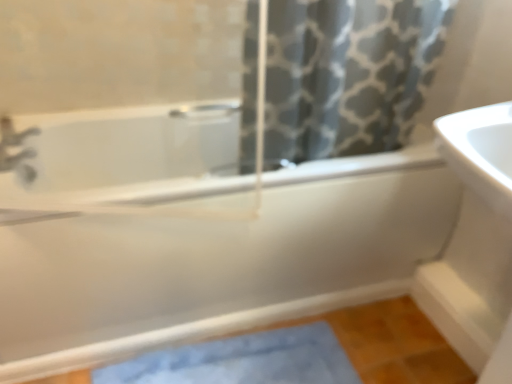
Question: Should I look upward or downward to see gray printed fabric at upper center?

Choices:
 (A) up
 (B) down

Answer: (A)

Question: From a real-world perspective, is white glossy sink at right positioned over blue fabric bath mat at lower center based on gravity?

Choices:
 (A) yes
 (B) no

Answer: (A)

Question: Are white glossy sink at right and blue fabric bath mat at lower center beside each other?

Choices:
 (A) yes
 (B) no

Answer: (B)

Question: Could you tell me if white glossy sink at right is facing blue fabric bath mat at lower center?

Choices:
 (A) no
 (B) yes

Answer: (A)

Question: From a real-world perspective, is white glossy sink at right below blue fabric bath mat at lower center?

Choices:
 (A) yes
 (B) no

Answer: (B)

Question: Can you confirm if white glossy sink at right is bigger than blue fabric bath mat at lower center?

Choices:
 (A) yes
 (B) no

Answer: (A)

Question: From the image's perspective, is white glossy sink at right under blue fabric bath mat at lower center?

Choices:
 (A) yes
 (B) no

Answer: (B)

Question: From a real-world perspective, is blue fabric bath mat at lower center over white glossy sink at right?

Choices:
 (A) no
 (B) yes

Answer: (A)

Question: From a real-world perspective, is blue fabric bath mat at lower center physically below white glossy sink at right?

Choices:
 (A) no
 (B) yes

Answer: (B)

Question: From the image's perspective, would you say blue fabric bath mat at lower center is shown under white glossy sink at right?

Choices:
 (A) no
 (B) yes

Answer: (B)

Question: Is blue fabric bath mat at lower center in front of white glossy sink at right?

Choices:
 (A) yes
 (B) no

Answer: (B)

Question: Does blue fabric bath mat at lower center turn towards white glossy sink at right?

Choices:
 (A) yes
 (B) no

Answer: (B)

Question: Does blue fabric bath mat at lower center have a larger size compared to white glossy sink at right?

Choices:
 (A) no
 (B) yes

Answer: (A)

Question: Is the position of blue fabric bath mat at lower center less distant than that of matte silver faucet at upper left?

Choices:
 (A) no
 (B) yes

Answer: (B)